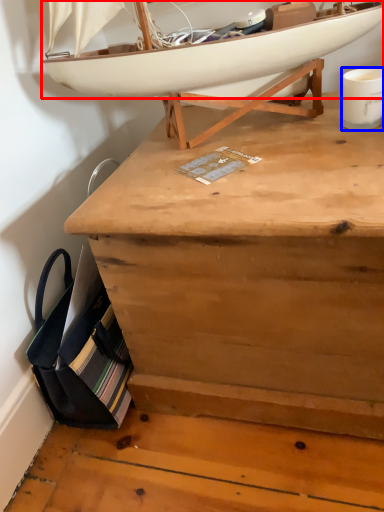
Question: Which object appears farthest to the camera in this image, boat (highlighted by a red box) or coffee cup (highlighted by a blue box)?

Choices:
 (A) boat
 (B) coffee cup

Answer: (B)